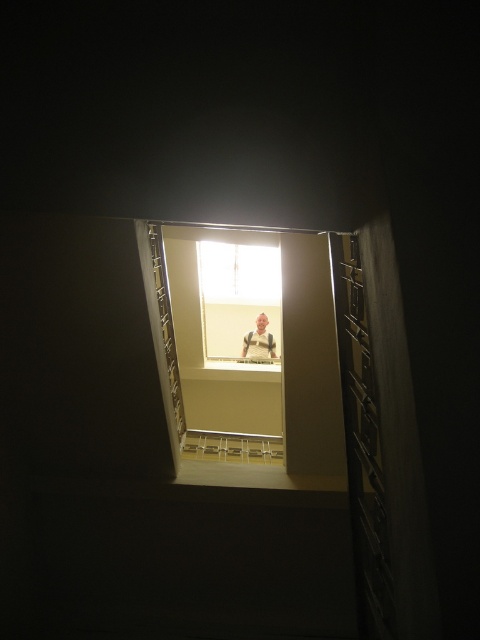
Question: Which point is farther from the camera taking this photo?

Choices:
 (A) (220, 264)
 (B) (240, 433)

Answer: (A)

Question: Does white plastic stair at center lie in front of smooth beige shirt at center?

Choices:
 (A) no
 (B) yes

Answer: (B)

Question: Is clear glass window at center further to the viewer compared to white plastic stair at center?

Choices:
 (A) no
 (B) yes

Answer: (B)

Question: Is white plastic stair at center bigger than smooth beige shirt at center?

Choices:
 (A) no
 (B) yes

Answer: (A)

Question: Estimate the real-world distances between objects in this image. Which object is closer to the white plastic stair at center?

Choices:
 (A) smooth beige shirt at center
 (B) clear glass window at center

Answer: (A)

Question: Which point appears closest to the camera in this image?

Choices:
 (A) (274, 339)
 (B) (182, 448)

Answer: (B)